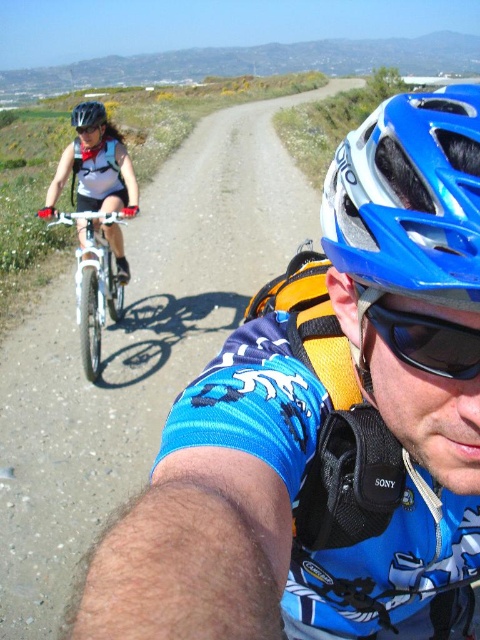
Question: Is blue matte bicycle helmet at center wider than matte black helmet at upper left?

Choices:
 (A) no
 (B) yes

Answer: (A)

Question: Which object is farther from the camera taking this photo?

Choices:
 (A) black matte goggles at center
 (B) white matte bicycle at left
 (C) matte black helmet at upper left
 (D) blue matte bicycle helmet at center

Answer: (C)

Question: Is black matte goggles at center positioned before white matte bicycle at left?

Choices:
 (A) no
 (B) yes

Answer: (B)

Question: Based on their relative distances, which object is farther from the white matte bicycle at left?

Choices:
 (A) black matte goggles at center
 (B) blue matte bicycle helmet at center
 (C) matte black helmet at upper left

Answer: (B)

Question: Can you confirm if white matte bicycle at left is positioned to the right of matte black helmet at upper left?

Choices:
 (A) no
 (B) yes

Answer: (B)

Question: Which object is positioned closest to the matte black helmet at upper left?

Choices:
 (A) black matte goggles at center
 (B) white matte bicycle at left
 (C) blue matte bicycle helmet at center

Answer: (B)